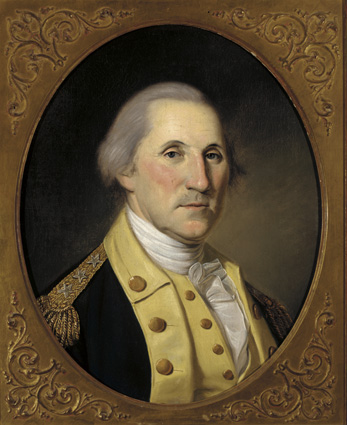
Where is `pattern on frame`? The image size is (347, 425). pattern on frame is located at coordinates (287, 396).